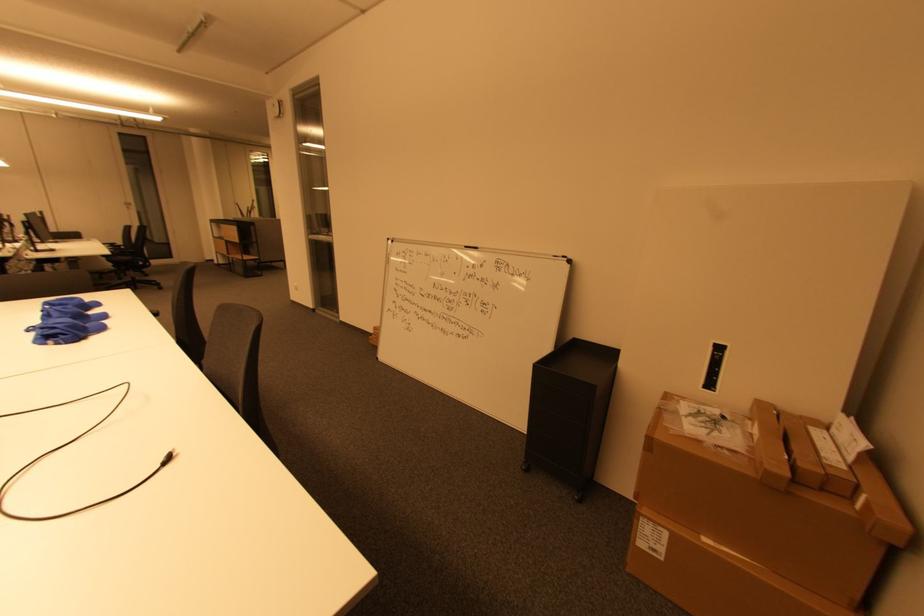
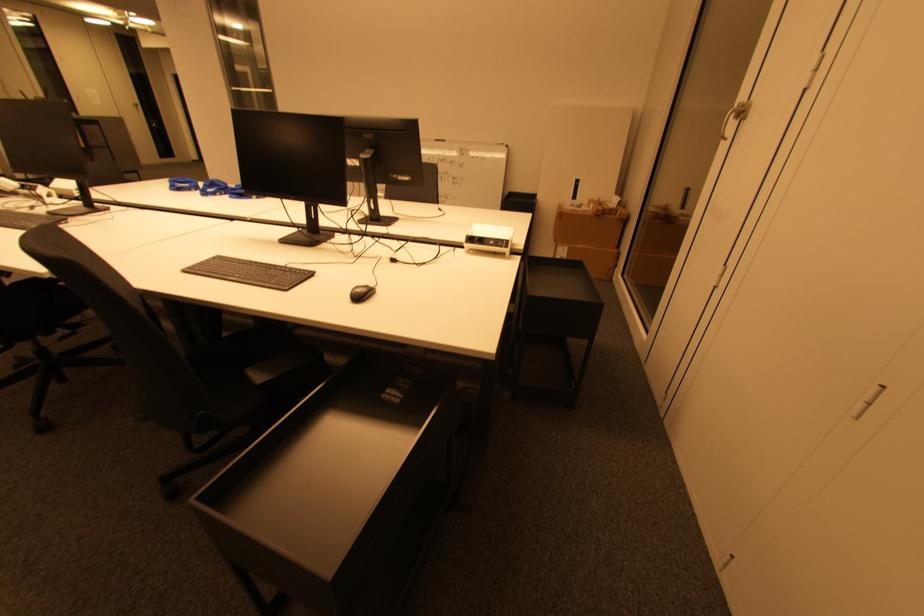
Which direction would the cameraman need to move to produce the second image?

The movement direction of the cameraman is left, backward.